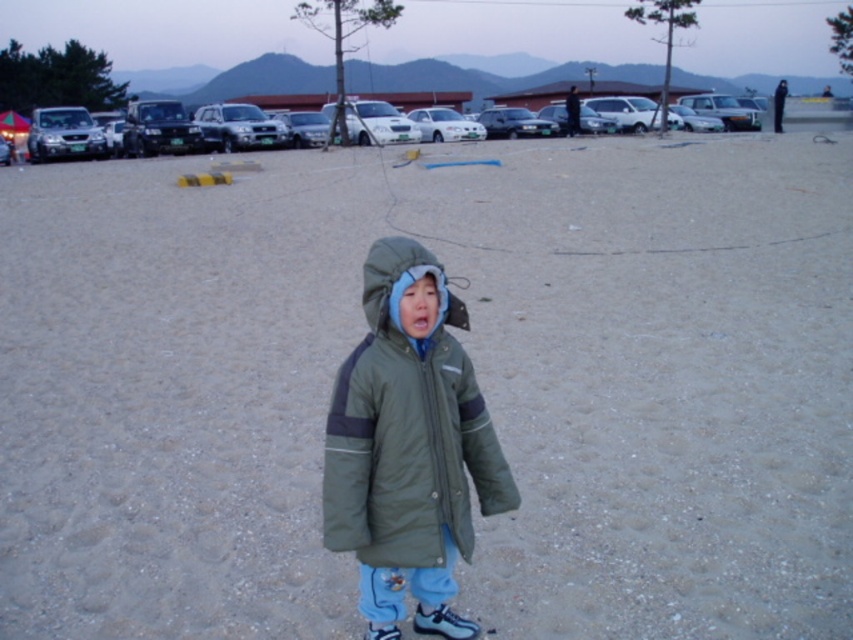
Question: Does green fleece hood at center have a smaller size compared to sleek silver sedan at center?

Choices:
 (A) yes
 (B) no

Answer: (A)

Question: Can you confirm if silver metallic suv at left is thinner than silver metallic suv at upper left?

Choices:
 (A) yes
 (B) no

Answer: (B)

Question: Which is nearer to the green fleece hood at center?

Choices:
 (A) metallic gray sedan at center
 (B) silver metallic suv at upper left

Answer: (B)

Question: Among these points, which one is nearest to the camera?

Choices:
 (A) (154, 116)
 (B) (444, 122)
 (C) (35, 109)

Answer: (A)

Question: In this image, where is metallic silver suv at upper center located relative to silver metallic suv at left?

Choices:
 (A) above
 (B) below

Answer: (A)

Question: Which of the following is the closest to the observer?

Choices:
 (A) (408, 122)
 (B) (486, 122)
 (C) (451, 140)
 (D) (53, 132)

Answer: (D)